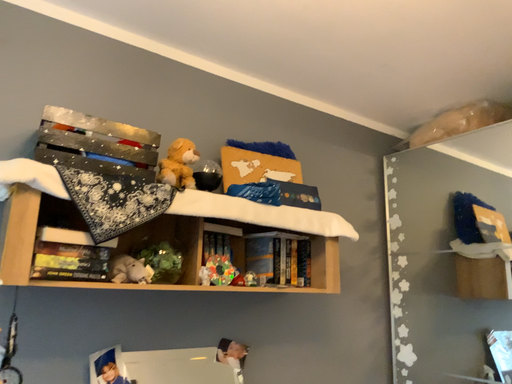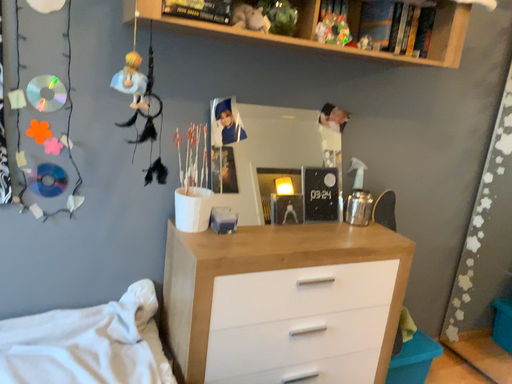
Question: How did the camera likely rotate when shooting the video?

Choices:
 (A) rotated left
 (B) rotated right

Answer: (A)